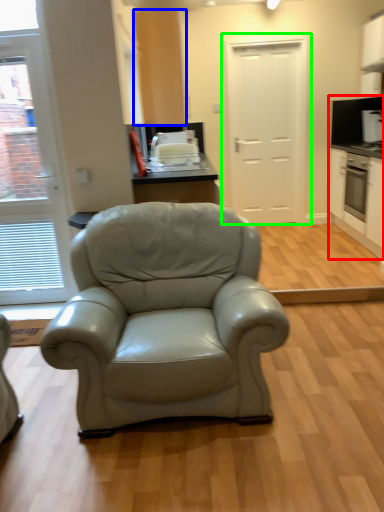
Question: Which object is positioned farthest from cabinetry (highlighted by a red box)? Select from cabinetry (highlighted by a blue box) and door (highlighted by a green box).

Choices:
 (A) cabinetry
 (B) door

Answer: (A)